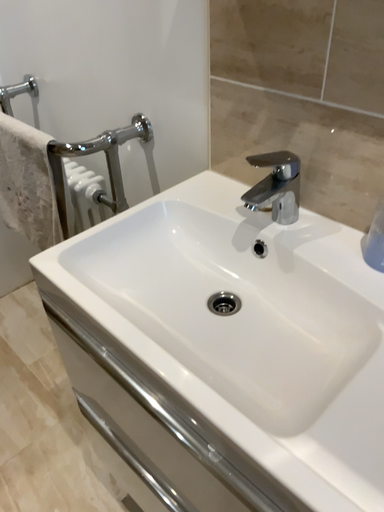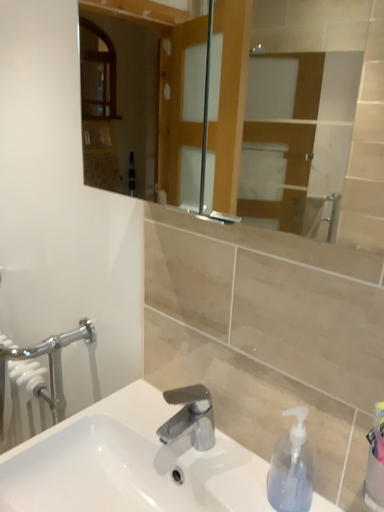
Question: How did the camera likely rotate when shooting the video?

Choices:
 (A) rotated upward
 (B) rotated downward

Answer: (A)